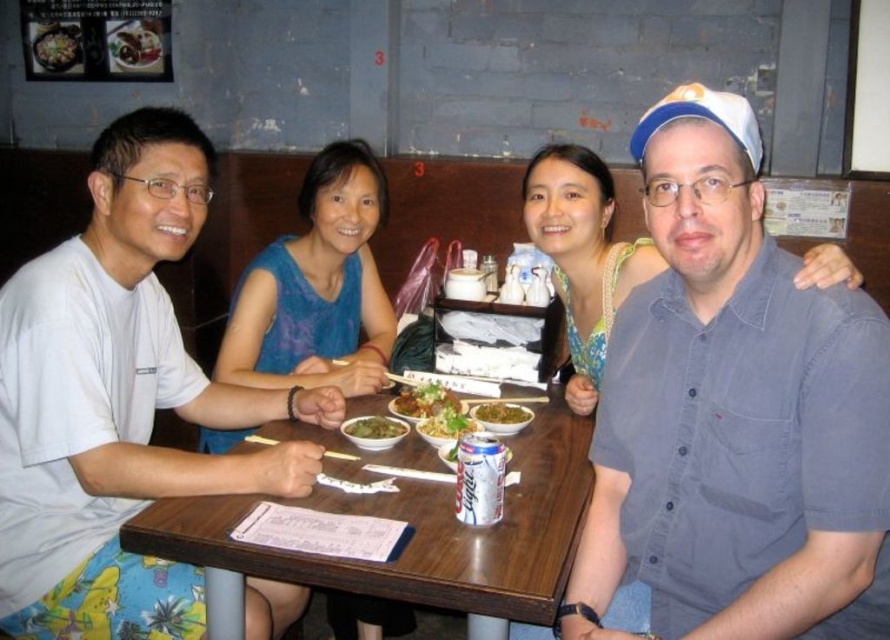
How much distance is there between green leafy vegetable at table center and green leafy vegetable at center?

They are 3.19 inches apart.

Is point (423, 428) behind point (514, 422)?

That is False.

You are a GUI agent. You are given a task and a screenshot of the screen. Output one action in this format:
    pyautogui.click(x=<x>, y=<y>)
    Task: Click on the green leafy vegetable at table center
    Image resolution: width=890 pixels, height=640 pixels.
    Given the screenshot: What is the action you would take?
    pyautogui.click(x=445, y=424)

Can you confirm if white cotton shirt at left is shorter than green leafy vegetable at table center?

No, white cotton shirt at left is not shorter than green leafy vegetable at table center.

Which is more to the left, white cotton shirt at left or green leafy vegetable at table center?

white cotton shirt at left

Does point (78, 326) come in front of point (470, 429)?

Yes, point (78, 326) is closer to viewer.

Image resolution: width=890 pixels, height=640 pixels. What are the coordinates of `white cotton shirt at left` in the screenshot? It's located at (120, 403).

Does blue denim shirt at right have a smaller size compared to brown glossy rice bowl at center?

Incorrect, blue denim shirt at right is not smaller in size than brown glossy rice bowl at center.

Which is in front, point (774, 445) or point (402, 394)?

Positioned in front is point (774, 445).

Who is more forward, (653,339) or (409,387)?

Positioned in front is point (653,339).

This screenshot has height=640, width=890. I want to click on blue denim shirt at right, so click(x=734, y=413).